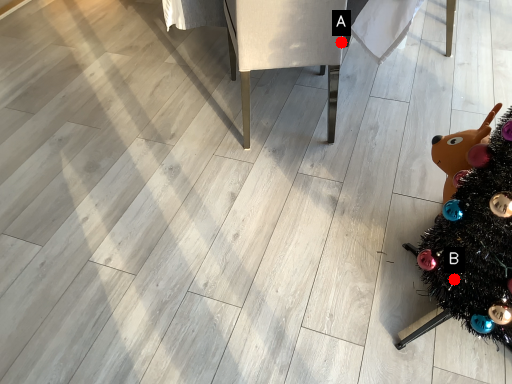
Question: Two points are circled on the image, labeled by A and B beside each circle. Which of the following is the farthest from the observer?

Choices:
 (A) A is further
 (B) B is further

Answer: (A)